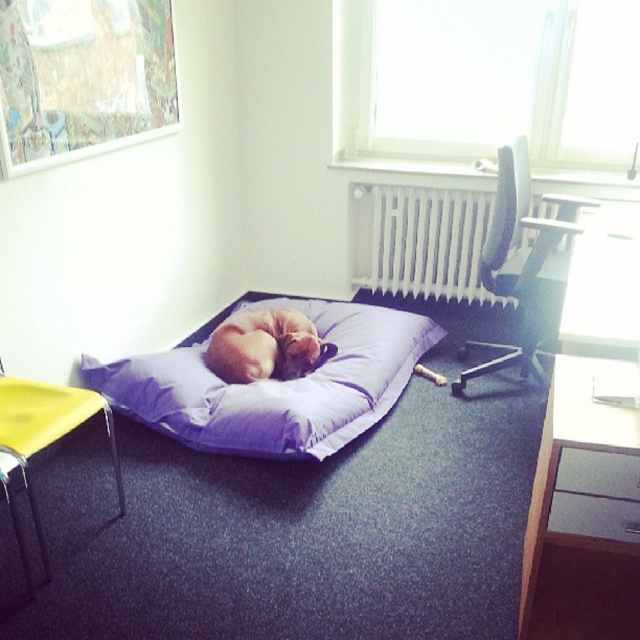
Question: Can you confirm if purple fabric sleeping bag at center is positioned below yellow fabric chair at lower left?

Choices:
 (A) yes
 (B) no

Answer: (B)

Question: Is black mesh office chair at upper right closer to the viewer compared to yellow fabric chair at lower left?

Choices:
 (A) no
 (B) yes

Answer: (A)

Question: Which object is positioned closest to the soft beige cat at center?

Choices:
 (A) black mesh office chair at upper right
 (B) yellow fabric chair at lower left

Answer: (B)

Question: Which of the following is the farthest from the observer?

Choices:
 (A) (534, 264)
 (B) (19, 406)
 (C) (413, 218)

Answer: (C)

Question: Is the position of yellow fabric chair at lower left more distant than that of soft beige cat at center?

Choices:
 (A) yes
 (B) no

Answer: (B)

Question: Considering the real-world distances, which object is closest to the yellow fabric chair at lower left?

Choices:
 (A) white glossy computer desk at upper right
 (B) white metallic radiator at upper center

Answer: (A)